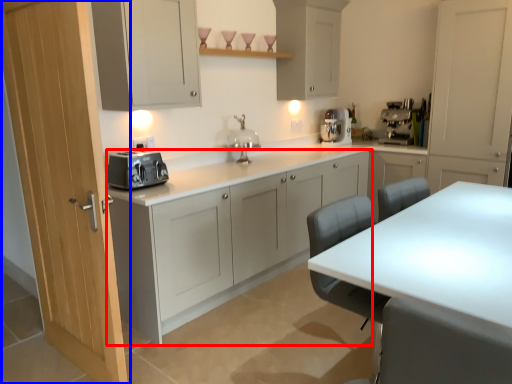
Question: Which object is further to the camera taking this photo, cabinetry (highlighted by a red box) or door (highlighted by a blue box)?

Choices:
 (A) cabinetry
 (B) door

Answer: (A)